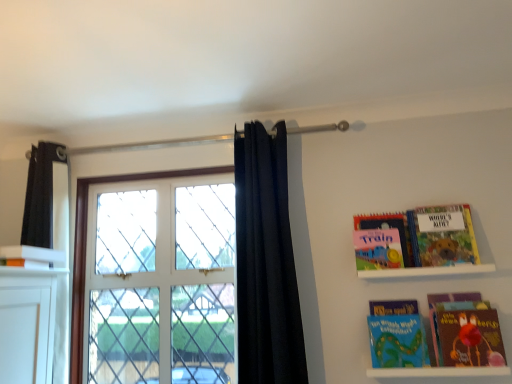
This screenshot has width=512, height=384. I want to click on free point below matte red book at lower right (from a real-world perspective), so click(x=468, y=361).